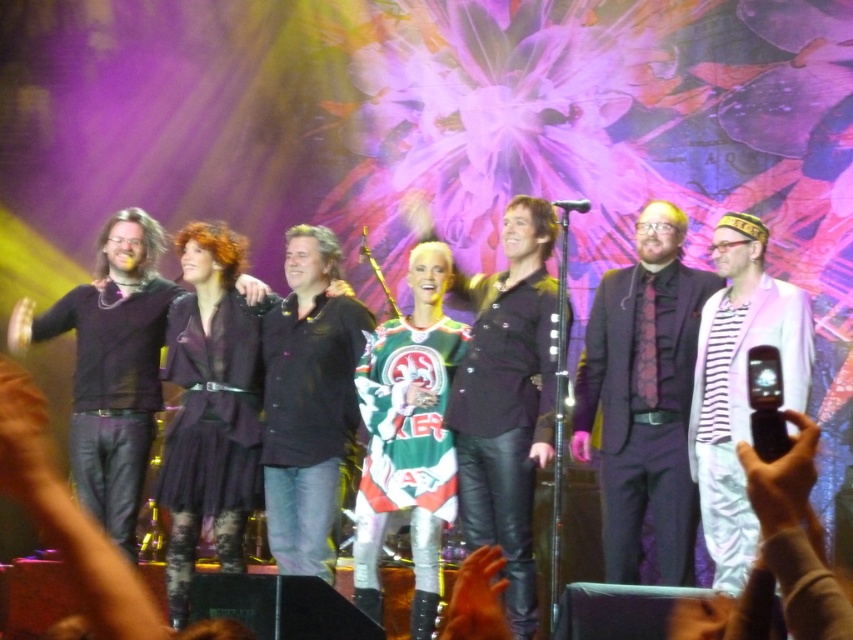
You are a stagehand preparing to adjust the lighting for the performers. You need to ensure that the dark purple suit at center and the matte black jacket at center are both illuminated properly. Considering their heights, which performer should you adjust the spotlight for first?

The dark purple suit at center has a greater height compared to matte black jacket at center, so you should adjust the spotlight for the dark purple suit at center first to ensure proper illumination based on its taller stature.

You are a photographer standing at the front of the stage. You want to take a photo that includes both the point at (746, 388) and the point at (248, 285). Which point will appear larger in your photo?

Point at (746, 388) will appear larger in the photo because it is closer to the camera than point at (248, 285).